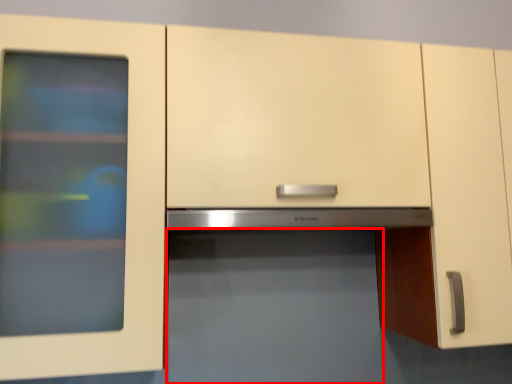
Question: From the image's perspective, where is appliance (annotated by the red box) located in relation to exhaust hood in the image?

Choices:
 (A) below
 (B) above

Answer: (A)